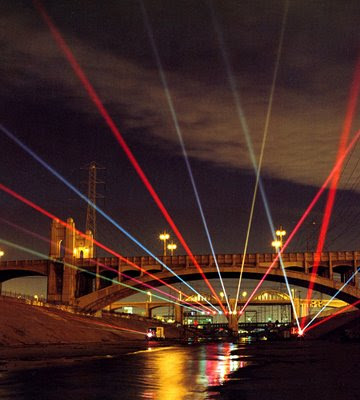
I want to click on lights, so click(165, 236), click(170, 244), click(282, 231), click(279, 241), click(244, 292), click(221, 293).